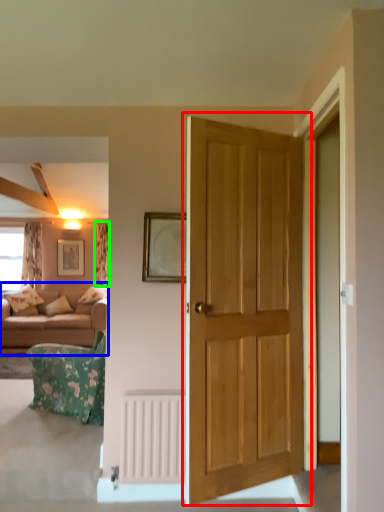
Question: Which object is positioned farthest from door (highlighted by a red box)? Select from studio couch (highlighted by a blue box) and curtain (highlighted by a green box).

Choices:
 (A) studio couch
 (B) curtain

Answer: (B)